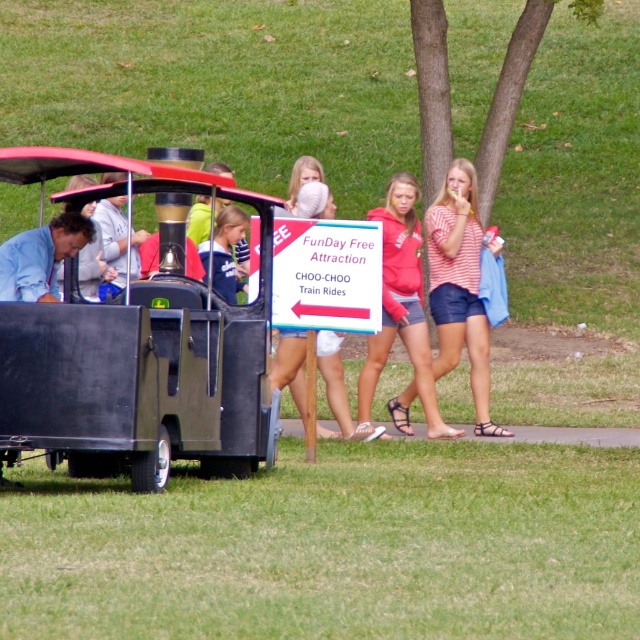
Question: Which object appears farthest from the camera in this image?

Choices:
 (A) white paper sign at center
 (B) matte red hoodie at center
 (C) matte black wagon at left
 (D) striped cotton shirt at center

Answer: (D)

Question: Does matte black wagon at left appear under white paper sign at center?

Choices:
 (A) yes
 (B) no

Answer: (A)

Question: Is matte black wagon at left to the left of white paper sign at center from the viewer's perspective?

Choices:
 (A) no
 (B) yes

Answer: (B)

Question: Is striped cotton shirt at center further to the viewer compared to matte red hoodie at center?

Choices:
 (A) yes
 (B) no

Answer: (A)

Question: Among these objects, which one is nearest to the camera?

Choices:
 (A) matte black wagon at left
 (B) matte red hoodie at center
 (C) striped cotton shirt at center

Answer: (A)

Question: Which of these objects is positioned farthest from the white paper sign at center?

Choices:
 (A) striped cotton shirt at center
 (B) matte black wagon at left
 (C) matte red hoodie at center

Answer: (A)